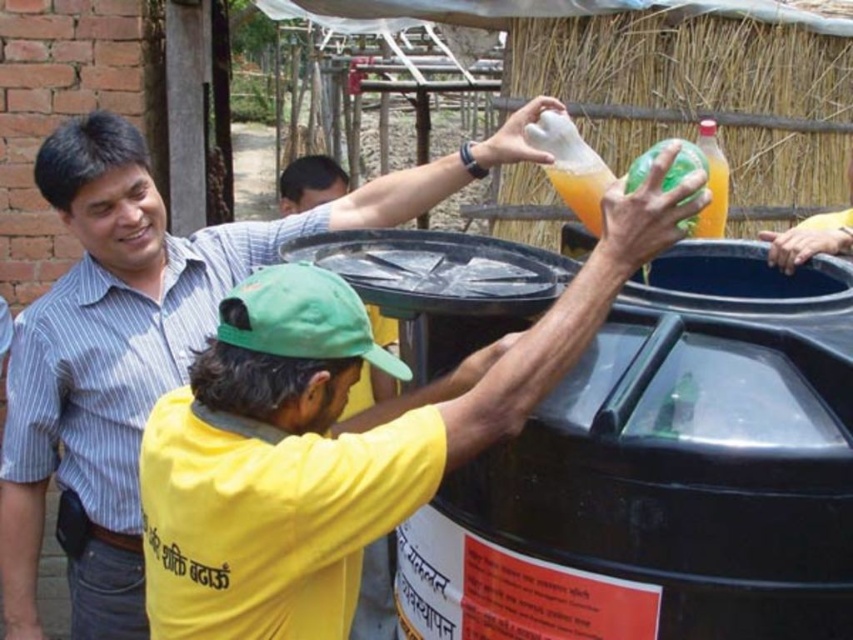
From the picture: You are a photographer trying to capture a clear shot of the matte black shirt at center and the translucent plastic bottle at upper right. Since you want both subjects to be in focus, you need to know their relative sizes in the frame. Which object is taller?

The matte black shirt at center is taller than the translucent plastic bottle at upper right.

Consider the image. You are a photographer trying to capture a clear shot of the yellow matte shirt at center and the translucent plastic bottle at upper right. Which object should you focus on first to ensure both are in focus?

You should focus on the yellow matte shirt at center first because it is closer to you than the translucent plastic bottle at upper right. By focusing on the closer object, the background object may still be in focus depending on the depth of field.

You are a photographer trying to capture a clear shot of both the matte black shirt at center and the yellow matte shirt at center. Since you want both subjects to be fully visible in the frame, which subject should you focus on first to ensure they are in focus, considering their heights?

The matte black shirt at center is much taller than the yellow matte shirt at center, so you should focus on the matte black shirt at center first to ensure proper focus, as it occupies more vertical space in the frame.